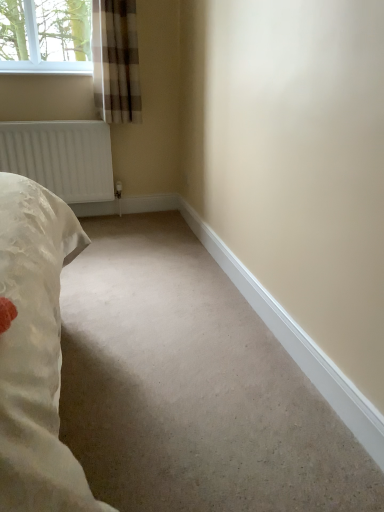
Describe the element at coordinates (61, 157) in the screenshot. This screenshot has width=384, height=512. I see `white matte radiator at left` at that location.

Measure the distance between white matte radiator at left and camera.

8.58 feet.

At what (x,y) coordinates should I click in order to perform the action: click on white matte radiator at left. Please return your answer as a coordinate pair (x, y). Looking at the image, I should click on (61, 157).

This screenshot has height=512, width=384. What do you see at coordinates (116, 61) in the screenshot? I see `plaid fabric curtain at upper left` at bounding box center [116, 61].

Identify the location of plaid fabric curtain at upper left. The height and width of the screenshot is (512, 384). (116, 61).

Identify the location of white matte radiator at left. (61, 157).

Considering the positions of objects white matte radiator at left and plaid fabric curtain at upper left in the image provided, who is more to the left, white matte radiator at left or plaid fabric curtain at upper left?

From the viewer's perspective, white matte radiator at left appears more on the left side.

Is the depth of white matte radiator at left greater than that of plaid fabric curtain at upper left?

Yes, the depth of white matte radiator at left is greater than that of plaid fabric curtain at upper left.

Does point (70, 168) come behind point (134, 39)?

That is True.

From the image's perspective, which one is positioned higher, white matte radiator at left or plaid fabric curtain at upper left?

plaid fabric curtain at upper left is shown above in the image.

From a real-world perspective, which object rests below the other?

white matte radiator at left, from a real-world perspective.

Can you confirm if white matte radiator at left is thinner than plaid fabric curtain at upper left?

Correct, the width of white matte radiator at left is less than that of plaid fabric curtain at upper left.

Is white matte radiator at left shorter than plaid fabric curtain at upper left?

Correct, white matte radiator at left is not as tall as plaid fabric curtain at upper left.

Considering the relative sizes of white matte radiator at left and plaid fabric curtain at upper left in the image provided, is white matte radiator at left bigger than plaid fabric curtain at upper left?

Yes.

Would you say white matte radiator at left is inside or outside plaid fabric curtain at upper left?

white matte radiator at left is not inside plaid fabric curtain at upper left, it's outside.

Are white matte radiator at left and plaid fabric curtain at upper left far apart?

That's not correct — white matte radiator at left is a little close to plaid fabric curtain at upper left.

Is white matte radiator at left facing towards plaid fabric curtain at upper left?

No, white matte radiator at left is not oriented towards plaid fabric curtain at upper left.

This screenshot has width=384, height=512. In order to click on radiator lying on the left of plaid fabric curtain at upper left in this screenshot , I will do `click(61, 157)`.

Can you confirm if plaid fabric curtain at upper left is positioned to the right of white matte radiator at left?

Yes, plaid fabric curtain at upper left is to the right of white matte radiator at left.

Considering their positions, is plaid fabric curtain at upper left located in front of or behind white matte radiator at left?

plaid fabric curtain at upper left is in front of white matte radiator at left.

Is point (109, 116) closer to camera compared to point (67, 200)?

Yes, point (109, 116) is in front of point (67, 200).

From the image's perspective, is plaid fabric curtain at upper left under white matte radiator at left?

Incorrect, from the image's perspective, plaid fabric curtain at upper left is higher than white matte radiator at left.

From a real-world perspective, is plaid fabric curtain at upper left under white matte radiator at left?

No.

Considering the sizes of objects plaid fabric curtain at upper left and white matte radiator at left in the image provided, who is wider, plaid fabric curtain at upper left or white matte radiator at left?

Wider between the two is plaid fabric curtain at upper left.

Does plaid fabric curtain at upper left have a lesser height compared to white matte radiator at left?

In fact, plaid fabric curtain at upper left may be taller than white matte radiator at left.

Who is bigger, plaid fabric curtain at upper left or white matte radiator at left?

white matte radiator at left is bigger.

Is plaid fabric curtain at upper left not within white matte radiator at left?

Yes, plaid fabric curtain at upper left is not within white matte radiator at left.

Is plaid fabric curtain at upper left not near white matte radiator at left?

Actually, plaid fabric curtain at upper left and white matte radiator at left are a little close together.

Is plaid fabric curtain at upper left facing away from white matte radiator at left?

plaid fabric curtain at upper left does not have its back to white matte radiator at left.

Consider the image. How many degrees apart are the facing directions of plaid fabric curtain at upper left and white matte radiator at left?

They differ by 0.000508 degrees in their facing directions.

How far apart are plaid fabric curtain at upper left and white matte radiator at left?

A distance of 15.44 inches exists between plaid fabric curtain at upper left and white matte radiator at left.

Locate an element on the screen. This screenshot has height=512, width=384. radiator located behind the plaid fabric curtain at upper left is located at coordinates (61, 157).

I want to click on curtain that is above the white matte radiator at left (from the image's perspective), so click(116, 61).

You are a GUI agent. You are given a task and a screenshot of the screen. Output one action in this format:
    pyautogui.click(x=<x>, y=<y>)
    Task: Click on the radiator below the plaid fabric curtain at upper left (from the image's perspective)
    This screenshot has height=512, width=384.
    Given the screenshot: What is the action you would take?
    click(x=61, y=157)